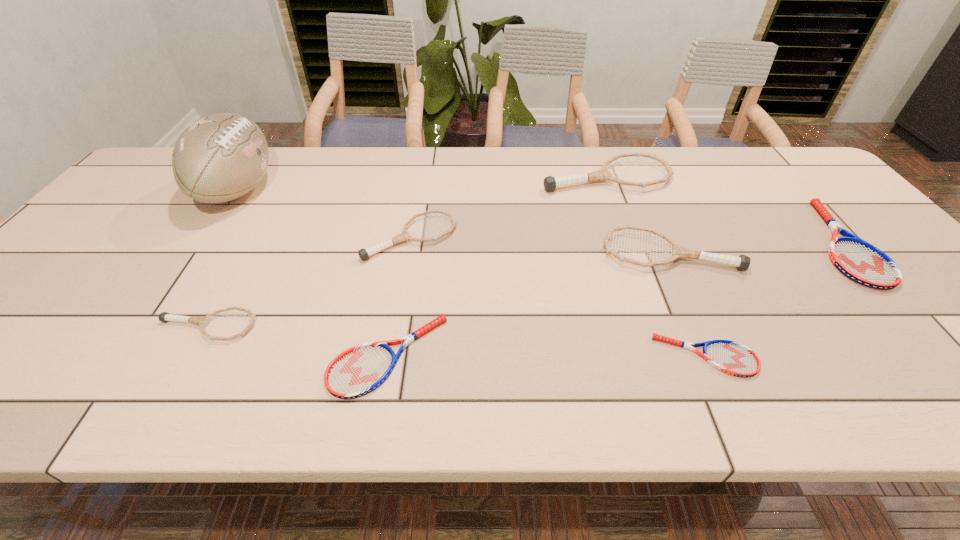
At what (x,y) coordinates should I click in order to perform the action: click on the rightmost tennis racket. Please return your answer as a coordinate pair (x, y). The image size is (960, 540). Looking at the image, I should click on (860, 261).

Locate an element on the screen. Image resolution: width=960 pixels, height=540 pixels. the leftmost blue tennis racket is located at coordinates (357, 371).

I want to click on the second shortest tennis racket, so click(357, 371).

Locate an element on the screen. the second blue tennis racket from right to left is located at coordinates (733, 358).

This screenshot has width=960, height=540. In order to click on the smallest blue tennis racket in this screenshot , I will do `click(733, 358)`.

Find the location of a particular element. The width and height of the screenshot is (960, 540). free space located on the laces of the tallest object is located at coordinates (402, 190).

Locate an element on the screen. free location located 0.310m on the right of the farthest tennis racket is located at coordinates (770, 177).

Where is `vacant space located on the left of the third tallest object`? Image resolution: width=960 pixels, height=540 pixels. vacant space located on the left of the third tallest object is located at coordinates (513, 252).

Locate an element on the screen. The height and width of the screenshot is (540, 960). vacant space located on the right of the third biggest gray tennis racket is located at coordinates (525, 238).

Image resolution: width=960 pixels, height=540 pixels. I want to click on vacant area situated 0.070m on the left of the nearest gray tennis racket, so click(x=128, y=326).